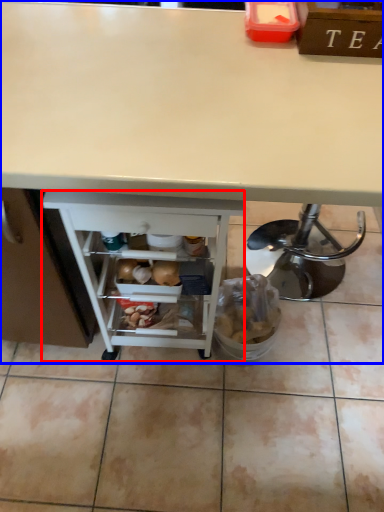
Question: Which point is closer to the camera, shelf (highlighted by a red box) or desk (highlighted by a blue box)?

Choices:
 (A) shelf
 (B) desk

Answer: (B)